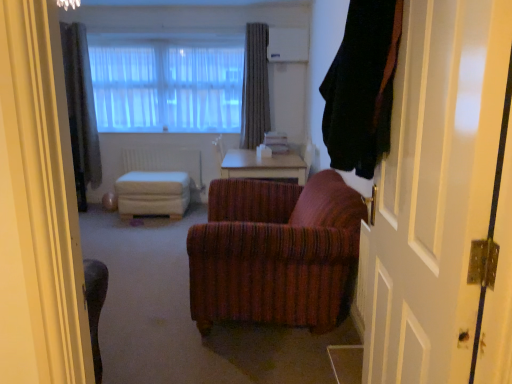
Question: Could you tell me if gray textured curtain at upper center, which is counted as the 2th curtain, starting from the left, is turned towards white fabric ottoman at center?

Choices:
 (A) no
 (B) yes

Answer: (A)

Question: Would you say gray textured curtain at upper center, placed as the 3th curtain when sorted from front to back, is outside white fabric ottoman at center?

Choices:
 (A) yes
 (B) no

Answer: (A)

Question: From the image's perspective, does gray textured curtain at upper center, placed as the 3th curtain when sorted from front to back, appear higher than white fabric ottoman at center?

Choices:
 (A) yes
 (B) no

Answer: (A)

Question: Does gray textured curtain at upper center, which is counted as the 2th curtain, starting from the right, appear on the right side of white fabric ottoman at center?

Choices:
 (A) yes
 (B) no

Answer: (A)

Question: From a real-world perspective, is gray textured curtain at upper center, which is counted as the 2th curtain, starting from the left, physically located above or below gray textured curtain at upper left, positioned as the 2th curtain in front-to-back order?

Choices:
 (A) below
 (B) above

Answer: (B)

Question: Is gray textured curtain at upper center, placed as the 3th curtain when sorted from front to back, to the left or to the right of gray textured curtain at upper left, placed as the third curtain when sorted from right to left, in the image?

Choices:
 (A) left
 (B) right

Answer: (B)

Question: Is point (241, 140) positioned closer to the camera than point (86, 41)?

Choices:
 (A) farther
 (B) closer

Answer: (A)

Question: Considering the positions of gray textured curtain at upper center, placed as the 3th curtain when sorted from front to back, and gray textured curtain at upper left, positioned as the 2th curtain in front-to-back order, in the image, is gray textured curtain at upper center, placed as the 3th curtain when sorted from front to back, bigger or smaller than gray textured curtain at upper left, positioned as the 2th curtain in front-to-back order,?

Choices:
 (A) small
 (B) big

Answer: (A)

Question: Does point (183, 66) appear closer or farther from the camera than point (154, 147)?

Choices:
 (A) farther
 (B) closer

Answer: (B)

Question: From a real-world perspective, is translucent fabric at upper center above or below white matte radiator at center?

Choices:
 (A) below
 (B) above

Answer: (B)

Question: Is translucent fabric at upper center in front of or behind white matte radiator at center in the image?

Choices:
 (A) front
 (B) behind

Answer: (A)

Question: From their relative heights in the image, would you say translucent fabric at upper center is taller or shorter than white matte radiator at center?

Choices:
 (A) tall
 (B) short

Answer: (A)

Question: Is light brown wooden table at center to the left or to the right of white matte radiator at center in the image?

Choices:
 (A) right
 (B) left

Answer: (A)

Question: Considering their positions, is light brown wooden table at center located in front of or behind white matte radiator at center?

Choices:
 (A) behind
 (B) front

Answer: (B)